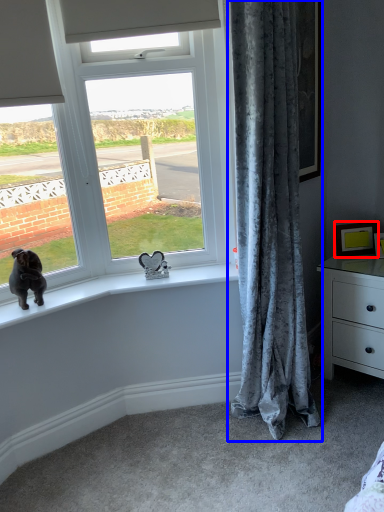
Question: Which point is closer to the camera, picture frame (highlighted by a red box) or curtain (highlighted by a blue box)?

Choices:
 (A) picture frame
 (B) curtain

Answer: (B)